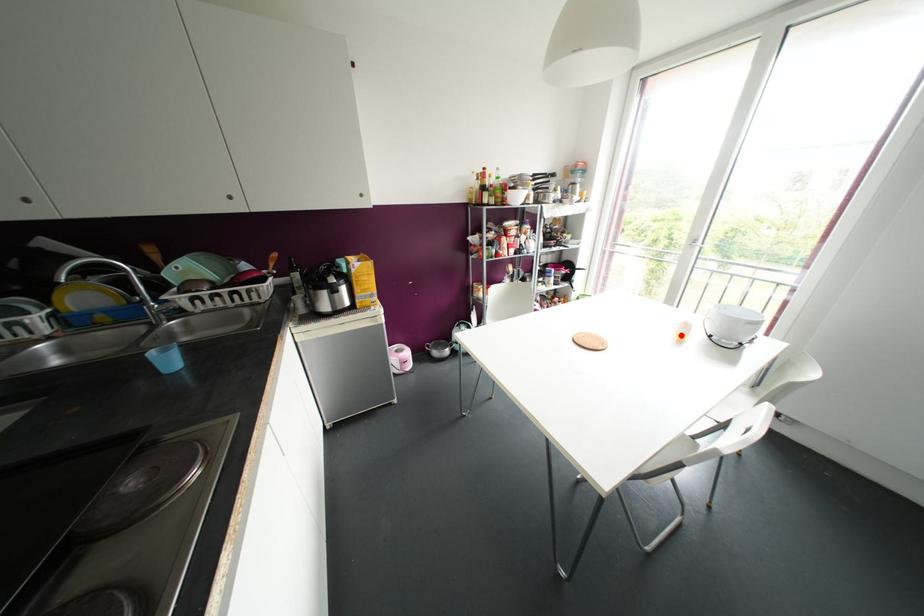
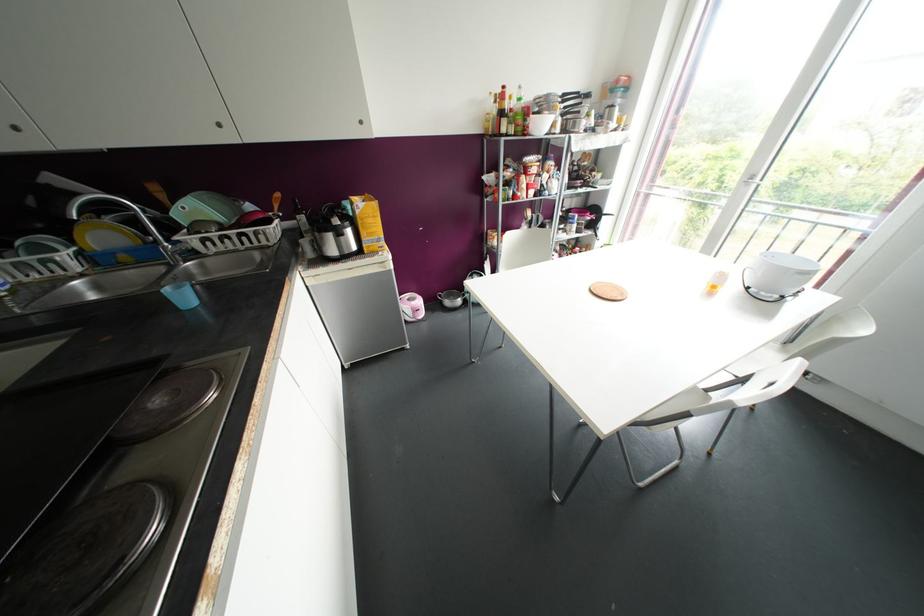
The point at the highlighted location is marked in the first image. Where is the corresponding point in the second image?

(713, 286)